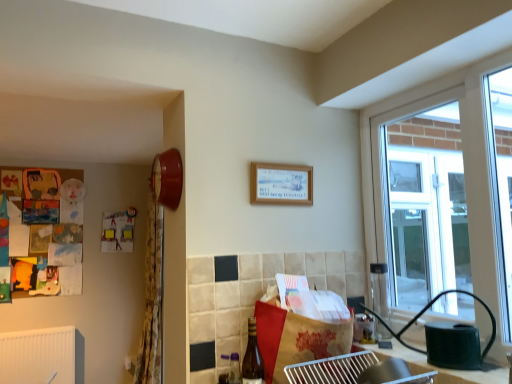
Question: Is point (291, 337) closer or farther from the camera than point (175, 162)?

Choices:
 (A) farther
 (B) closer

Answer: (B)

Question: In terms of height, does brown paper bag at center look taller or shorter compared to matte red clock at upper left?

Choices:
 (A) tall
 (B) short

Answer: (A)

Question: Which of these objects is positioned farthest from the matte red clock at upper left?

Choices:
 (A) brown paper bag at center
 (B) metallic silver tray at lower center
 (C) yellow floral fabric curtain at left
 (D) wooden picture frame at upper center
 (E) brown glass bottle at lower center

Answer: (C)

Question: Based on their relative distances, which object is farther from the metallic silver tray at lower center?

Choices:
 (A) wooden picture frame at upper center
 (B) yellow floral fabric curtain at left
 (C) matte red clock at upper left
 (D) brown paper bag at center
 (E) brown glass bottle at lower center

Answer: (B)